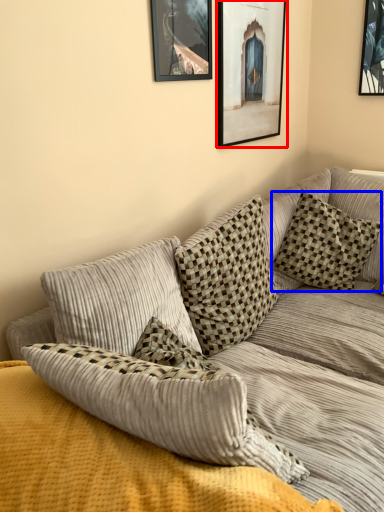
Question: Which object is closer to the camera taking this photo, picture frame (highlighted by a red box) or pillow (highlighted by a blue box)?

Choices:
 (A) picture frame
 (B) pillow

Answer: (A)